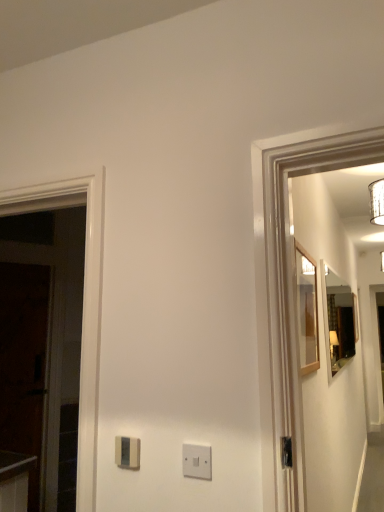
Question: From a real-world perspective, is wooden-framed mirror at right, the 2th mirror from the right, under satin beige light switch at center, which is counted as the second light switch, starting from the right?

Choices:
 (A) no
 (B) yes

Answer: (A)

Question: Is wooden-framed mirror at right, the 2th mirror from the right, smaller than satin beige light switch at center, which is counted as the second light switch, starting from the right?

Choices:
 (A) yes
 (B) no

Answer: (B)

Question: Would you say wooden-framed mirror at right, the 2th mirror from the right, is outside satin beige light switch at center, the second light switch when ordered from front to back?

Choices:
 (A) yes
 (B) no

Answer: (A)

Question: Can you confirm if wooden-framed mirror at right, the first mirror in the front-to-back sequence, is taller than satin beige light switch at center, the 1th light switch in the left-to-right sequence?

Choices:
 (A) no
 (B) yes

Answer: (B)

Question: Considering the relative sizes of wooden-framed mirror at right, the first mirror in the front-to-back sequence, and satin beige light switch at center, which is counted as the second light switch, starting from the right, in the image provided, is wooden-framed mirror at right, the first mirror in the front-to-back sequence, bigger than satin beige light switch at center, which is counted as the second light switch, starting from the right,?

Choices:
 (A) yes
 (B) no

Answer: (A)

Question: Does wooden-framed mirror at right, arranged as the 1th mirror when viewed from the left, appear on the left side of satin beige light switch at center, the 1th light switch in the left-to-right sequence?

Choices:
 (A) yes
 (B) no

Answer: (B)

Question: From a real-world perspective, is matte wooden mirror at right, which is the second mirror from left to right, physically above satin beige light switch at center, the 1th light switch in the left-to-right sequence?

Choices:
 (A) no
 (B) yes

Answer: (B)

Question: From the image's perspective, is matte wooden mirror at right, the 1th mirror in the back-to-front sequence, on satin beige light switch at center, the 1th light switch in the left-to-right sequence?

Choices:
 (A) no
 (B) yes

Answer: (B)

Question: Considering the relative positions of matte wooden mirror at right, the 1th mirror in the back-to-front sequence, and satin beige light switch at center, the 1th light switch in the left-to-right sequence, in the image provided, is matte wooden mirror at right, the 1th mirror in the back-to-front sequence, in front of satin beige light switch at center, the 1th light switch in the left-to-right sequence,?

Choices:
 (A) yes
 (B) no

Answer: (B)

Question: Is matte wooden mirror at right, the 1th mirror in the back-to-front sequence, at the right side of satin beige light switch at center, the second light switch when ordered from front to back?

Choices:
 (A) yes
 (B) no

Answer: (A)

Question: Can you confirm if matte wooden mirror at right, the 1th mirror in the back-to-front sequence, is bigger than satin beige light switch at center, the 1th light switch in the left-to-right sequence?

Choices:
 (A) no
 (B) yes

Answer: (B)

Question: Is matte wooden mirror at right, which is the second mirror from left to right, outside of satin beige light switch at center, which is counted as the second light switch, starting from the right?

Choices:
 (A) yes
 (B) no

Answer: (A)

Question: Would you say white plastic light switch at center, marked as the first light switch in a front-to-back arrangement, is outside satin beige light switch at center, which is counted as the second light switch, starting from the right?

Choices:
 (A) no
 (B) yes

Answer: (B)